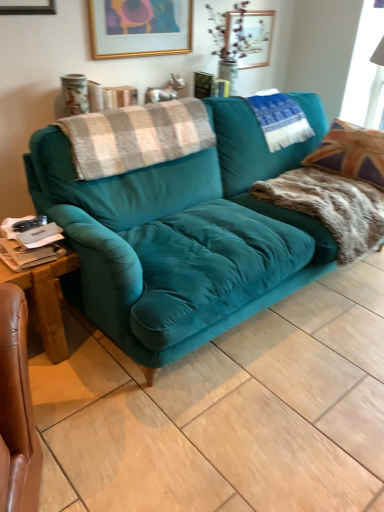
Question: Is wooden picture frame at upper center, which is counted as the second picture frame, starting from the front, next to fur-like fabric pillow at right?

Choices:
 (A) yes
 (B) no

Answer: (B)

Question: Does wooden picture frame at upper center, the first picture frame viewed from the back, have a greater width compared to fur-like fabric pillow at right?

Choices:
 (A) no
 (B) yes

Answer: (A)

Question: Considering the relative positions of wooden picture frame at upper center, which is counted as the second picture frame, starting from the front, and fur-like fabric pillow at right in the image provided, is wooden picture frame at upper center, which is counted as the second picture frame, starting from the front, behind fur-like fabric pillow at right?

Choices:
 (A) no
 (B) yes

Answer: (B)

Question: From the image's perspective, is wooden picture frame at upper center, which is counted as the second picture frame, starting from the front, below fur-like fabric pillow at right?

Choices:
 (A) yes
 (B) no

Answer: (B)

Question: Is wooden picture frame at upper center, marked as the 1th picture frame in a right-to-left arrangement, not within fur-like fabric pillow at right?

Choices:
 (A) no
 (B) yes

Answer: (B)

Question: Which is correct: wooden picture frame at upper center, marked as the 1th picture frame in a right-to-left arrangement, is inside gold-framed picture at upper center, arranged as the 2th picture frame when viewed from the right, or outside of it?

Choices:
 (A) inside
 (B) outside

Answer: (B)

Question: From a real-world perspective, is wooden picture frame at upper center, the first picture frame viewed from the back, above or below gold-framed picture at upper center, the 1th picture frame viewed from the front?

Choices:
 (A) below
 (B) above

Answer: (A)

Question: Is wooden picture frame at upper center, marked as the 1th picture frame in a right-to-left arrangement, in front of or behind gold-framed picture at upper center, the 1th picture frame viewed from the front, in the image?

Choices:
 (A) front
 (B) behind

Answer: (B)

Question: From the image's perspective, is wooden picture frame at upper center, the first picture frame viewed from the back, located above or below gold-framed picture at upper center, arranged as the 2th picture frame when viewed from the right?

Choices:
 (A) below
 (B) above

Answer: (B)

Question: From the image's perspective, relative to gold-framed picture at upper center, the second picture frame when ordered from back to front, is teal velvet couch at center above or below?

Choices:
 (A) below
 (B) above

Answer: (A)

Question: Is teal velvet couch at center wider or thinner than gold-framed picture at upper center, the 1th picture frame viewed from the front?

Choices:
 (A) thin
 (B) wide

Answer: (B)

Question: Is teal velvet couch at center in front of or behind gold-framed picture at upper center, the 1th picture frame viewed from the front, in the image?

Choices:
 (A) front
 (B) behind

Answer: (A)

Question: Considering the relative positions of teal velvet couch at center and gold-framed picture at upper center, the 1th picture frame viewed from the front, in the image provided, is teal velvet couch at center to the left or to the right of gold-framed picture at upper center, the 1th picture frame viewed from the front,?

Choices:
 (A) left
 (B) right

Answer: (B)

Question: In terms of height, does teal velvet pillow at upper right look taller or shorter compared to teal velvet couch at center?

Choices:
 (A) short
 (B) tall

Answer: (A)

Question: Is teal velvet pillow at upper right to the left or to the right of teal velvet couch at center in the image?

Choices:
 (A) left
 (B) right

Answer: (B)